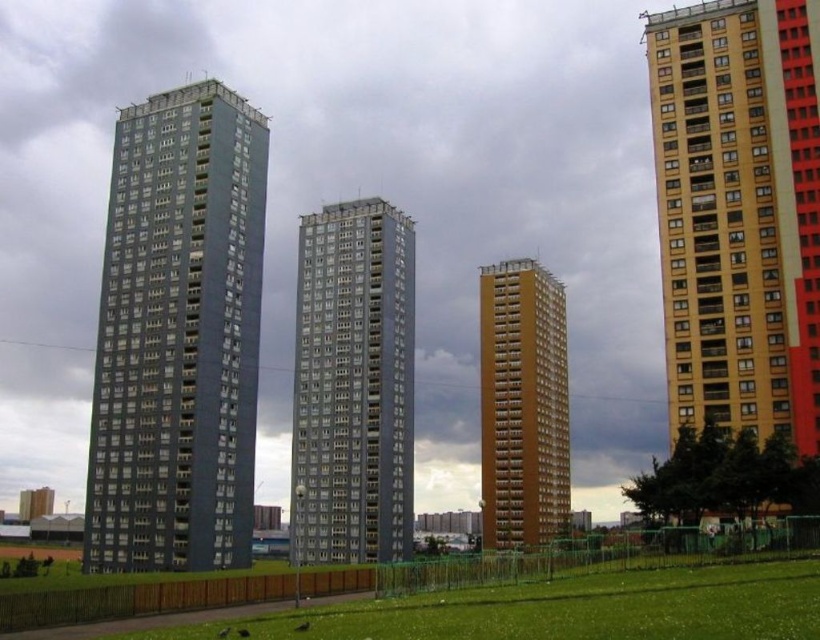
You are standing in the grassy area at the bottom of the image and want to walk to the gray concrete building at center. There is a yellow matte building at right blocking your path. Can you walk around it to reach your destination?

The yellow matte building at right is 50.03 meters away from the gray concrete building at center, so you can walk around the yellow matte building at right to reach the gray concrete building at center.

You are standing at the grassy area in front of the row of buildings. You notice two points marked on the image. The first point is at coordinate point (140, 163) and the second point is at coordinate point (319, 531). Which of these two points is closer to you?

Point (140, 163) is in front of point (319, 531), so the first point is closer to you.